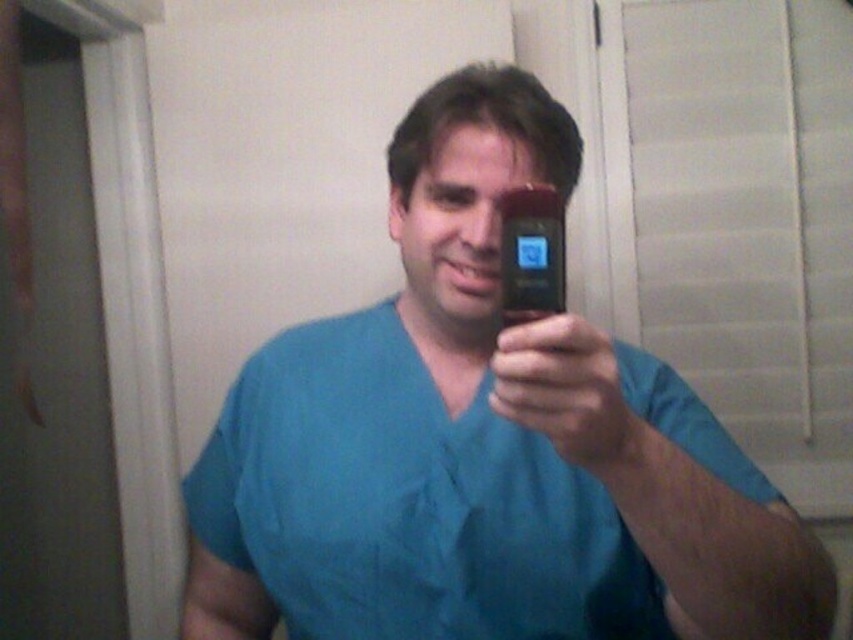
You are a nurse trying to determine if the blue fabric shirt at center can fully cover the black glossy smartphone at center when placing it inside a pocket. Based on their sizes, can the smartphone fit inside the shirt pocket?

The blue fabric shirt at center is wider than the black glossy smartphone at center, so it is likely that the smartphone can fit inside the shirt pocket as the shirt has a larger width.

You are a medical professional in a teal scrubs. You need to show a patient the results on your device. The patient is standing in front of you. Can the patient see the black matte phone at center better than the blue fabric shirt at center?

The blue fabric shirt at center is taller than the black matte phone at center, so the patient might have an easier time seeing the black matte phone at center since it is smaller and possibly closer to eye level.

You are a medical professional in a teal scrub and you need to show a patient a report on your device. The patient is standing in front of you. Which object, the blue fabric shirt at center or the black glossy smartphone at center, will the patient see as larger?

The blue fabric shirt at center will appear larger to the patient because it is bigger than the black glossy smartphone at center.